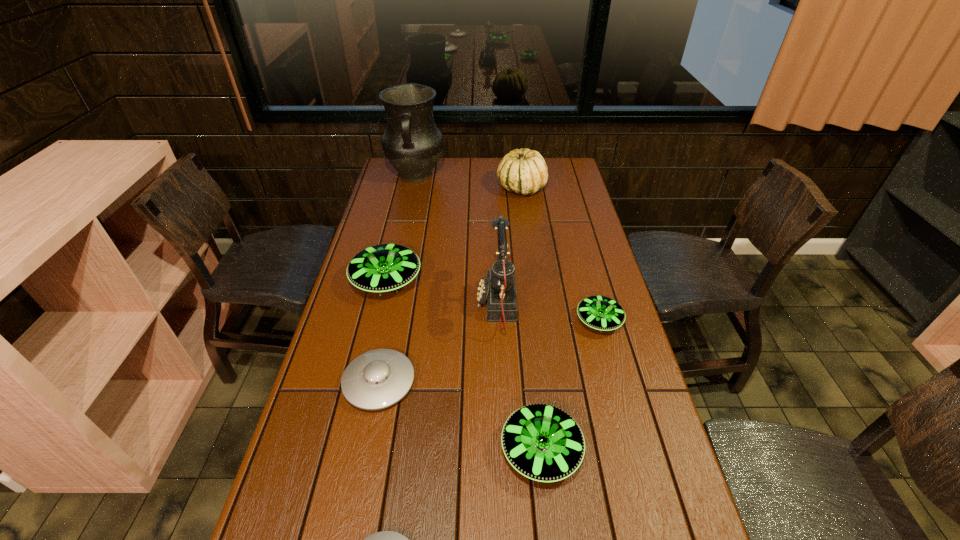
Find the location of a particular element. The width and height of the screenshot is (960, 540). pitcher is located at coordinates (412, 143).

What are the coordinates of `the tallest object` in the screenshot? It's located at (412, 143).

Locate an element on the screen. the seventh shortest object is located at coordinates (498, 289).

At what (x,y) coordinates should I click in order to perform the action: click on telephone. Please return your answer as a coordinate pair (x, y). The image size is (960, 540). Looking at the image, I should click on (498, 289).

Find the location of a particular element. gourd is located at coordinates (524, 171).

Locate an element on the screen. The image size is (960, 540). the third tallest object is located at coordinates coord(524,171).

Locate an element on the screen. The image size is (960, 540). the leftmost green saucer is located at coordinates (381, 268).

The height and width of the screenshot is (540, 960). What are the coordinates of `the fifth shortest object` in the screenshot? It's located at (381, 268).

At what (x,y) coordinates should I click in order to perform the action: click on the fourth farthest saucer. Please return your answer as a coordinate pair (x, y). This screenshot has width=960, height=540. Looking at the image, I should click on (542, 442).

Find the location of a particular element. The image size is (960, 540). the second green saucer from left to right is located at coordinates (542, 442).